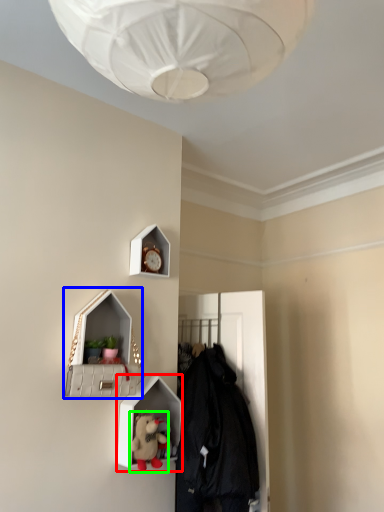
Question: Based on their relative distances, which object is nearer to shelf (highlighted by a red box)? Choose from medicine cabinet (highlighted by a blue box) and toy (highlighted by a green box).

Choices:
 (A) medicine cabinet
 (B) toy

Answer: (B)